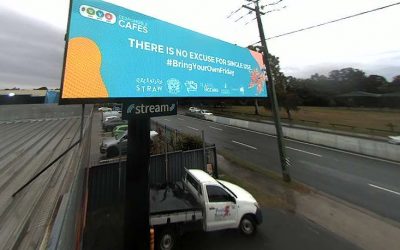
Image resolution: width=400 pixels, height=250 pixels. Identify the location of electrical wire. (309, 26).